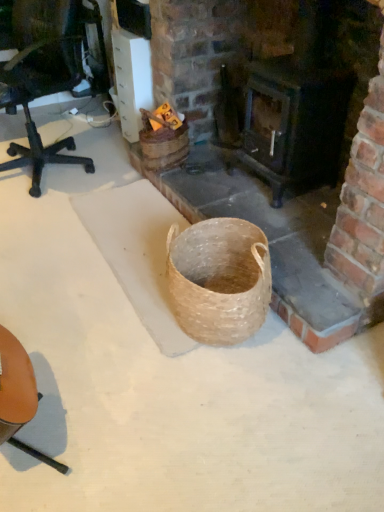
The height and width of the screenshot is (512, 384). I want to click on vacant area situated to the left side of dark wood stove at center, so click(220, 183).